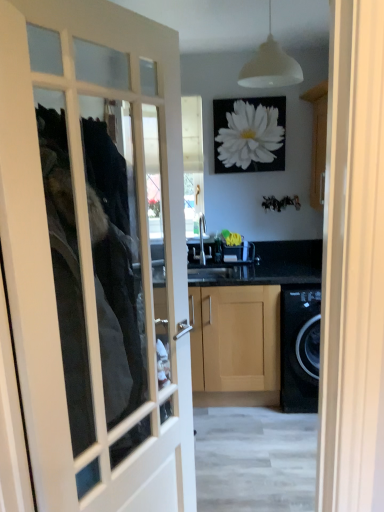
Describe the element at coordinates (249, 134) in the screenshot. I see `white matte flower at upper center` at that location.

Image resolution: width=384 pixels, height=512 pixels. What do you see at coordinates (270, 66) in the screenshot?
I see `white matte light fixture at upper center` at bounding box center [270, 66].

Image resolution: width=384 pixels, height=512 pixels. I want to click on white matte light fixture at upper center, so click(270, 66).

What are the coordinates of `white matte flower at upper center` in the screenshot? It's located at (249, 134).

Is there a large distance between light wood/finished cabinet at center and white matte light fixture at upper center?

Yes.

Considering the sizes of light wood/finished cabinet at center and white matte light fixture at upper center in the image, is light wood/finished cabinet at center bigger or smaller than white matte light fixture at upper center?

Considering their sizes, light wood/finished cabinet at center takes up more space than white matte light fixture at upper center.

Is white matte light fixture at upper center inside light wood/finished cabinet at center?

No, white matte light fixture at upper center is not surrounded by light wood/finished cabinet at center.

From the picture: Is light wood/finished cabinet at center to the left of white matte light fixture at upper center from the viewer's perspective?

Yes, light wood/finished cabinet at center is to the left of white matte light fixture at upper center.

Does light wood/finished cabinet at center turn towards white matte flower at upper center?

No, light wood/finished cabinet at center is not aimed at white matte flower at upper center.

From a real-world perspective, is light wood/finished cabinet at center physically above white matte flower at upper center?

No, from a real-world perspective, light wood/finished cabinet at center is not over white matte flower at upper center

What's the angular difference between light wood/finished cabinet at center and white matte flower at upper center's facing directions?

The facing directions of light wood/finished cabinet at center and white matte flower at upper center are 0.219 degrees apart.

Is light wood/finished cabinet at center at the left side of white matte flower at upper center?

Correct, you'll find light wood/finished cabinet at center to the left of white matte flower at upper center.

Could you tell me if white matte light fixture at upper center is turned towards white matte flower at upper center?

No, white matte light fixture at upper center is not turned towards white matte flower at upper center.

The width and height of the screenshot is (384, 512). What are the coordinates of `light fixture above the white matte flower at upper center (from the image's perspective)` in the screenshot? It's located at click(270, 66).

Which is in front, white matte light fixture at upper center or white matte flower at upper center?

white matte light fixture at upper center.

From a real-world perspective, is white matte light fixture at upper center on white matte flower at upper center?

Yes, from a real-world perspective, white matte light fixture at upper center is above white matte flower at upper center.

Is light wood/finished cabinet at center far from white glass door at center?

That's right, there is a large distance between light wood/finished cabinet at center and white glass door at center.

I want to click on door above the light wood/finished cabinet at center (from a real-world perspective), so click(x=96, y=256).

Which object is further away from the camera taking this photo, light wood/finished cabinet at center or white glass door at center?

light wood/finished cabinet at center.

Is light wood/finished cabinet at center oriented away from white glass door at center?

light wood/finished cabinet at center is not turned away from white glass door at center.

Is white glass door at center bigger than light wood/finished cabinet at center?

No, white glass door at center is not bigger than light wood/finished cabinet at center.

From the image's perspective, is white glass door at center above or below light wood/finished cabinet at center?

white glass door at center is situated higher than light wood/finished cabinet at center in the image.

Is white glass door at center touching light wood/finished cabinet at center?

No, white glass door at center is not touching light wood/finished cabinet at center.

From the image's perspective, is white matte light fixture at upper center beneath light wood/finished cabinet at center?

No, from the image's perspective, white matte light fixture at upper center is not beneath light wood/finished cabinet at center.

Locate an element on the screen. The width and height of the screenshot is (384, 512). cabinetry behind the white matte light fixture at upper center is located at coordinates (235, 345).

Which object is closer to the camera taking this photo, white matte light fixture at upper center or light wood/finished cabinet at center?

white matte light fixture at upper center is closer to the camera.

Can you confirm if white matte light fixture at upper center is taller than light wood/finished cabinet at center?

No.

Would you consider white glass door at center to be distant from white matte flower at upper center?

That's right, there is a large distance between white glass door at center and white matte flower at upper center.

From a real-world perspective, is white glass door at center positioned above or below white matte flower at upper center?

white glass door at center is below white matte flower at upper center.

Which object is wider, white glass door at center or white matte flower at upper center?

Wider between the two is white glass door at center.

Between white glass door at center and white matte flower at upper center, which one appears on the right side from the viewer's perspective?

Positioned to the right is white matte flower at upper center.

I want to click on cabinetry on the left of the white matte light fixture at upper center, so click(x=235, y=345).

Locate an element on the screen. This screenshot has width=384, height=512. flower behind the light wood/finished cabinet at center is located at coordinates (249, 134).

From the image, which object appears to be nearer to white matte light fixture at upper center, light wood/finished cabinet at center or white glass door at center?

light wood/finished cabinet at center.

From the image, which object appears to be nearer to light wood/finished cabinet at center, white matte flower at upper center or white glass door at center?

The object closer to light wood/finished cabinet at center is white glass door at center.

Looking at the image, which one is located further to white glass door at center, light wood/finished cabinet at center or white matte light fixture at upper center?

white matte light fixture at upper center is positioned further to the anchor white glass door at center.

Looking at this image, estimate the real-world distances between objects in this image. Which object is closer to white matte flower at upper center, white glass door at center or white matte light fixture at upper center?

white matte light fixture at upper center lies closer to white matte flower at upper center than the other object.

When comparing their distances from light wood/finished cabinet at center, does white matte light fixture at upper center or white matte flower at upper center seem closer?

Among the two, white matte flower at upper center is located nearer to light wood/finished cabinet at center.

When comparing their distances from white matte flower at upper center, does white matte light fixture at upper center or light wood/finished cabinet at center seem further?

light wood/finished cabinet at center.

Considering their positions, is white matte light fixture at upper center positioned further to white glass door at center than white matte flower at upper center?

The object further to white glass door at center is white matte light fixture at upper center.

Considering their positions, is light wood/finished cabinet at center positioned closer to white glass door at center than white matte flower at upper center?

Based on the image, light wood/finished cabinet at center appears to be nearer to white glass door at center.

The width and height of the screenshot is (384, 512). Find the location of `light fixture between white glass door at center and white matte flower at upper center from front to back`. light fixture between white glass door at center and white matte flower at upper center from front to back is located at coordinates (270, 66).

At what (x,y) coordinates should I click in order to perform the action: click on flower between white matte light fixture at upper center and light wood/finished cabinet at center in the up-down direction. Please return your answer as a coordinate pair (x, y). Looking at the image, I should click on pos(249,134).

You are a GUI agent. You are given a task and a screenshot of the screen. Output one action in this format:
    pyautogui.click(x=<x>, y=<y>)
    Task: Click on the light fixture located between white glass door at center and light wood/finished cabinet at center in the depth direction
    The image size is (384, 512).
    Given the screenshot: What is the action you would take?
    pyautogui.click(x=270, y=66)

Where is `cabinetry between white glass door at center and white matte flower at upper center from front to back`? cabinetry between white glass door at center and white matte flower at upper center from front to back is located at coordinates (235, 345).